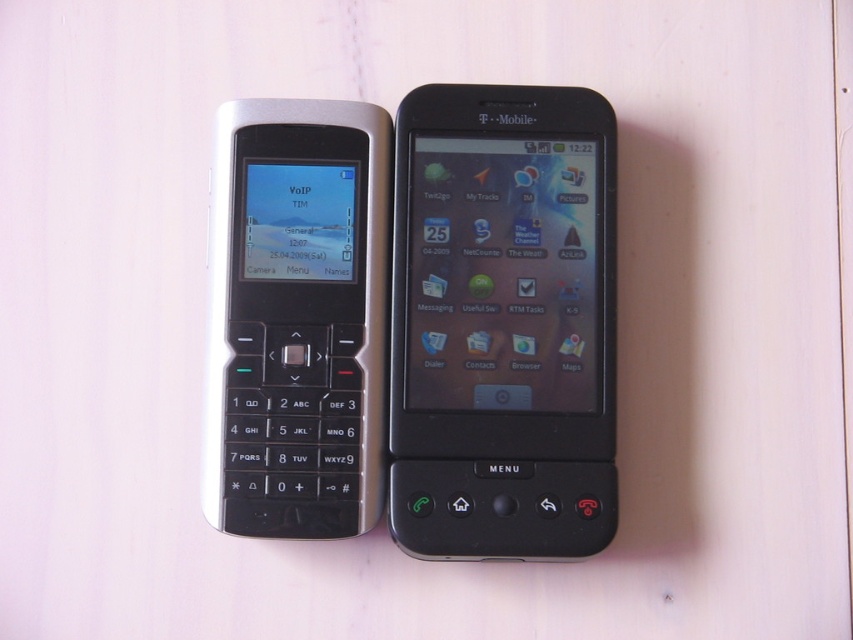
Question: Which of the following is the farthest from the observer?

Choices:
 (A) (265, 444)
 (B) (445, 177)

Answer: (B)

Question: Is the position of black plastic smartphone at center less distant than that of silver metallic keypad phone at left?

Choices:
 (A) yes
 (B) no

Answer: (B)

Question: Does black plastic smartphone at center come behind silver metallic keypad phone at left?

Choices:
 (A) yes
 (B) no

Answer: (A)

Question: Which point is closer to the camera?

Choices:
 (A) silver metallic keypad phone at left
 (B) black plastic smartphone at center

Answer: (A)

Question: Which point is farther from the camera taking this photo?

Choices:
 (A) (440, 476)
 (B) (252, 307)

Answer: (B)

Question: Does black plastic smartphone at center come in front of silver metallic keypad phone at left?

Choices:
 (A) yes
 (B) no

Answer: (B)